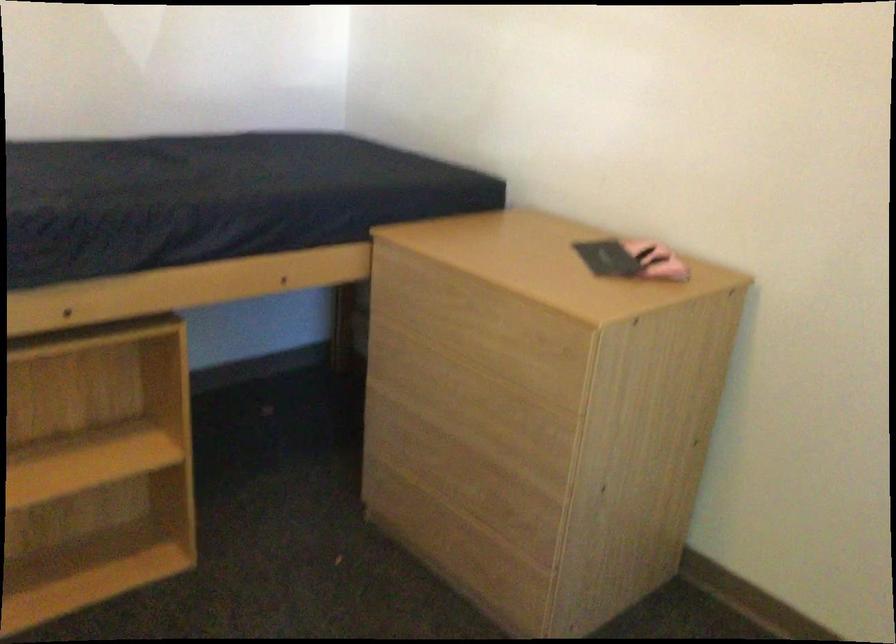
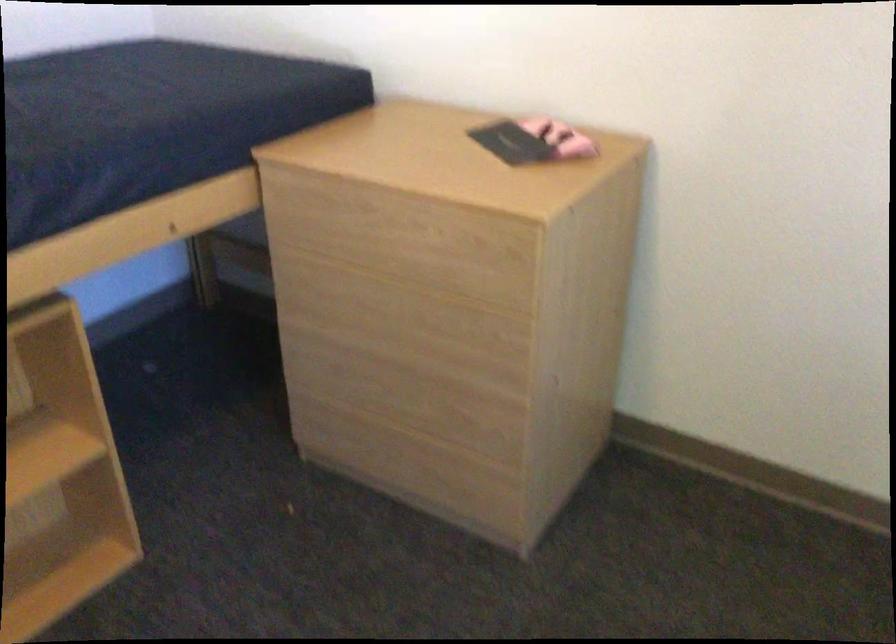
Question: The camera is either moving clockwise (left) or counter-clockwise (right) around the object. The first image is from the beginning of the video and the second image is from the end. Is the camera moving left or right when shooting the video?

Choices:
 (A) Left
 (B) Right

Answer: (A)